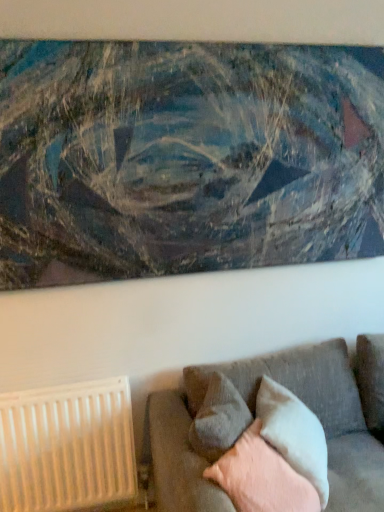
Based on the photo, in order to face gray fabric pillow at lower center, which is the 2th pillow in back-to-front order, should I rotate leftwards or rightwards?

To face it directly, rotate right by 3.560 degrees.

Locate an element on the screen. The width and height of the screenshot is (384, 512). soft gray cushion at lower right, arranged as the first pillow when viewed from the front is located at coordinates (261, 477).

The height and width of the screenshot is (512, 384). What do you see at coordinates (67, 447) in the screenshot?
I see `white plastic radiator at lower left` at bounding box center [67, 447].

Where is `textured gray couch at lower right`? The width and height of the screenshot is (384, 512). textured gray couch at lower right is located at coordinates (254, 416).

Is soft gray cushion at lower right, arranged as the first pillow when viewed from the front, in front of white plastic radiator at lower left?

Yes, soft gray cushion at lower right, arranged as the first pillow when viewed from the front, is closer to the viewer.

Considering the sizes of objects soft gray cushion at lower right, which is the 3th pillow from back to front, and white plastic radiator at lower left in the image provided, who is shorter, soft gray cushion at lower right, which is the 3th pillow from back to front, or white plastic radiator at lower left?

Standing shorter between the two is soft gray cushion at lower right, which is the 3th pillow from back to front.

Which is more to the right, gray fabric pillow at lower center, which is the 2th pillow in back-to-front order, or light gray fabric pillow at lower right, which ranks as the 3th pillow in front-to-back order?

From the viewer's perspective, light gray fabric pillow at lower right, which ranks as the 3th pillow in front-to-back order, appears more on the right side.

Based on their sizes in the image, would you say gray fabric pillow at lower center, positioned as the 2th pillow in front-to-back order, is bigger or smaller than light gray fabric pillow at lower right, which ranks as the first pillow in back-to-front order?

gray fabric pillow at lower center, positioned as the 2th pillow in front-to-back order, is smaller than light gray fabric pillow at lower right, which ranks as the first pillow in back-to-front order.

From a real-world perspective, which is physically above, gray fabric pillow at lower center, which is the 2th pillow in back-to-front order, or light gray fabric pillow at lower right, which ranks as the first pillow in back-to-front order?

gray fabric pillow at lower center, which is the 2th pillow in back-to-front order.

How different are the orientations of textured canvas painting at upper center and textured gray couch at lower right in degrees?

The facing directions of textured canvas painting at upper center and textured gray couch at lower right are 0.971 degrees apart.

From the image's perspective, which one is positioned lower, textured canvas painting at upper center or textured gray couch at lower right?

From the image's view, textured gray couch at lower right is below.

Measure the distance from textured canvas painting at upper center to textured gray couch at lower right.

A distance of 38.24 inches exists between textured canvas painting at upper center and textured gray couch at lower right.

Which is more to the right, textured canvas painting at upper center or textured gray couch at lower right?

textured gray couch at lower right is more to the right.

Which of these two, soft gray cushion at lower right, arranged as the first pillow when viewed from the front, or textured gray couch at lower right, is wider?

textured gray couch at lower right.

Based on the photo, is soft gray cushion at lower right, which is the 3th pillow from back to front, looking in the opposite direction of textured gray couch at lower right?

That's right, soft gray cushion at lower right, which is the 3th pillow from back to front, is facing away from textured gray couch at lower right.

From the picture: Considering the relative sizes of soft gray cushion at lower right, which is the 3th pillow from back to front, and textured gray couch at lower right in the image provided, is soft gray cushion at lower right, which is the 3th pillow from back to front, bigger than textured gray couch at lower right?

Actually, soft gray cushion at lower right, which is the 3th pillow from back to front, might be smaller than textured gray couch at lower right.

Visually, is soft gray cushion at lower right, arranged as the first pillow when viewed from the front, positioned to the left or to the right of textured gray couch at lower right?

Based on their positions, soft gray cushion at lower right, arranged as the first pillow when viewed from the front, is located to the left of textured gray couch at lower right.

In the image, is soft gray cushion at lower right, arranged as the first pillow when viewed from the front, on the left side or the right side of textured canvas painting at upper center?

Based on their positions, soft gray cushion at lower right, arranged as the first pillow when viewed from the front, is located to the right of textured canvas painting at upper center.

Is soft gray cushion at lower right, which is the 3th pillow from back to front, facing away from textured canvas painting at upper center?

soft gray cushion at lower right, which is the 3th pillow from back to front, does not have its back to textured canvas painting at upper center.

From a real-world perspective, which is physically above, soft gray cushion at lower right, which is the 3th pillow from back to front, or textured canvas painting at upper center?

textured canvas painting at upper center, from a real-world perspective.

At what (x,y) coordinates should I click in order to perform the action: click on picture frame that appears above the soft gray cushion at lower right, arranged as the first pillow when viewed from the front (from a real-world perspective). Please return your answer as a coordinate pair (x, y). Looking at the image, I should click on (186, 158).

Can you confirm if textured canvas painting at upper center is smaller than soft gray cushion at lower right, arranged as the first pillow when viewed from the front?

Incorrect, textured canvas painting at upper center is not smaller in size than soft gray cushion at lower right, arranged as the first pillow when viewed from the front.

Is the depth of textured canvas painting at upper center greater than that of soft gray cushion at lower right, which is the 3th pillow from back to front?

Yes, textured canvas painting at upper center is further from the camera.

Is textured canvas painting at upper center oriented towards soft gray cushion at lower right, which is the 3th pillow from back to front?

No, textured canvas painting at upper center is not turned towards soft gray cushion at lower right, which is the 3th pillow from back to front.

Can you tell me how much white plastic radiator at lower left and textured canvas painting at upper center differ in facing direction?

The angular difference between white plastic radiator at lower left and textured canvas painting at upper center is 0.971 degrees.

Which object is positioned more to the left, white plastic radiator at lower left or textured canvas painting at upper center?

white plastic radiator at lower left.

How far apart are white plastic radiator at lower left and textured canvas painting at upper center?

They are 1.04 meters apart.

From a real-world perspective, is white plastic radiator at lower left on textured canvas painting at upper center?

No, from a real-world perspective, white plastic radiator at lower left is not over textured canvas painting at upper center

Where is `radiator that appears on the left of soft gray cushion at lower right, arranged as the first pillow when viewed from the front`? Image resolution: width=384 pixels, height=512 pixels. radiator that appears on the left of soft gray cushion at lower right, arranged as the first pillow when viewed from the front is located at coordinates (67, 447).

What are the coordinates of `pillow that appears above the light gray fabric pillow at lower right, which ranks as the 3th pillow in front-to-back order (from the image's perspective)` in the screenshot? It's located at (217, 416).

When comparing their distances from soft gray cushion at lower right, which is the 3th pillow from back to front, does white plastic radiator at lower left or textured gray couch at lower right seem closer?

textured gray couch at lower right lies closer to soft gray cushion at lower right, which is the 3th pillow from back to front, than the other object.

From the image, which object appears to be farther from textured gray couch at lower right, light gray fabric pillow at lower right, which ranks as the first pillow in back-to-front order, or soft gray cushion at lower right, arranged as the first pillow when viewed from the front?

The object further to textured gray couch at lower right is soft gray cushion at lower right, arranged as the first pillow when viewed from the front.

From the image, which object appears to be farther from light gray fabric pillow at lower right, which ranks as the 3th pillow in front-to-back order, soft gray cushion at lower right, which is the 3th pillow from back to front, or white plastic radiator at lower left?

white plastic radiator at lower left lies further to light gray fabric pillow at lower right, which ranks as the 3th pillow in front-to-back order, than the other object.

Considering their positions, is light gray fabric pillow at lower right, which ranks as the 3th pillow in front-to-back order, positioned further to textured gray couch at lower right than gray fabric pillow at lower center, positioned as the 2th pillow in front-to-back order?

Based on the image, gray fabric pillow at lower center, positioned as the 2th pillow in front-to-back order, appears to be further to textured gray couch at lower right.

Estimate the real-world distances between objects in this image. Which object is further from soft gray cushion at lower right, which is the 3th pillow from back to front, gray fabric pillow at lower center, which is the 2th pillow in back-to-front order, or light gray fabric pillow at lower right, which ranks as the 3th pillow in front-to-back order?

gray fabric pillow at lower center, which is the 2th pillow in back-to-front order, lies further to soft gray cushion at lower right, which is the 3th pillow from back to front, than the other object.

When comparing their distances from white plastic radiator at lower left, does gray fabric pillow at lower center, which is the 2th pillow in back-to-front order, or soft gray cushion at lower right, which is the 3th pillow from back to front, seem further?

Among the two, soft gray cushion at lower right, which is the 3th pillow from back to front, is located further to white plastic radiator at lower left.

Considering their positions, is white plastic radiator at lower left positioned closer to textured gray couch at lower right than gray fabric pillow at lower center, which is the 2th pillow in back-to-front order?

Among the two, gray fabric pillow at lower center, which is the 2th pillow in back-to-front order, is located nearer to textured gray couch at lower right.

Based on their spatial positions, is textured canvas painting at upper center or gray fabric pillow at lower center, positioned as the 2th pillow in front-to-back order, closer to textured gray couch at lower right?

Based on the image, gray fabric pillow at lower center, positioned as the 2th pillow in front-to-back order, appears to be nearer to textured gray couch at lower right.

This screenshot has width=384, height=512. In order to click on pillow between soft gray cushion at lower right, which is the 3th pillow from back to front, and light gray fabric pillow at lower right, which ranks as the 3th pillow in front-to-back order, in the front-back direction in this screenshot , I will do (x=217, y=416).

Locate an element on the screen. This screenshot has width=384, height=512. pillow between textured canvas painting at upper center and light gray fabric pillow at lower right, which ranks as the first pillow in back-to-front order, from top to bottom is located at coordinates (217, 416).

This screenshot has width=384, height=512. Find the location of `pillow between white plastic radiator at lower left and soft gray cushion at lower right, which is the 3th pillow from back to front, in the horizontal direction`. pillow between white plastic radiator at lower left and soft gray cushion at lower right, which is the 3th pillow from back to front, in the horizontal direction is located at coordinates (217, 416).

Locate an element on the screen. pillow between textured gray couch at lower right and gray fabric pillow at lower center, positioned as the 2th pillow in front-to-back order, in the front-back direction is located at coordinates (261, 477).